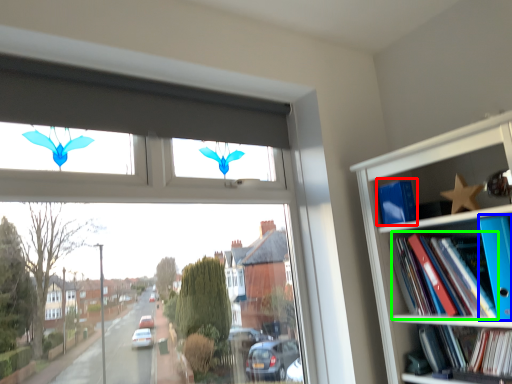
Question: Estimate the real-world distances between objects in this image. Which object is farther from paperback book (highlighted by a red box), paperback book (highlighted by a blue box) or book (highlighted by a green box)?

Choices:
 (A) paperback book
 (B) book

Answer: (A)